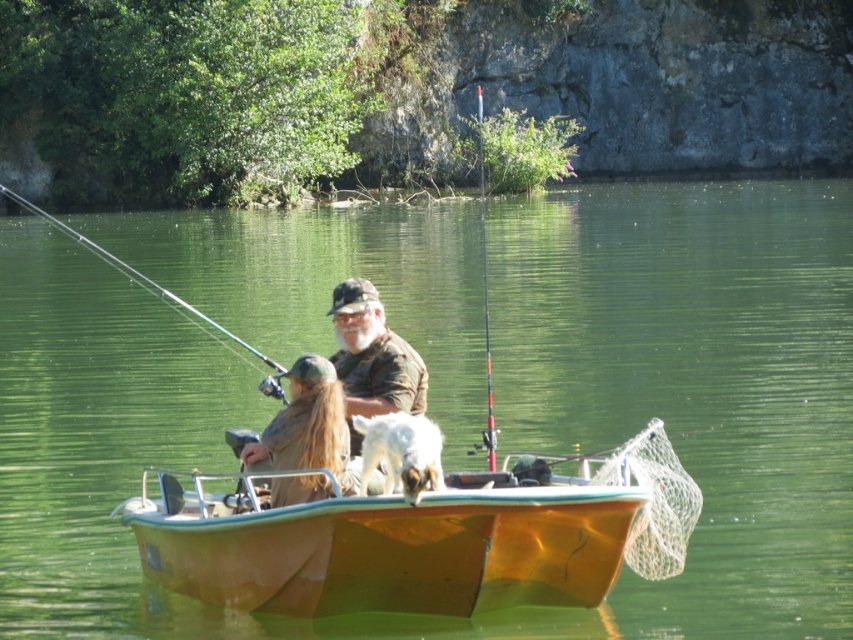
Question: Does white mesh fishing net at right have a smaller size compared to orange fiberglass fishing pole at center?

Choices:
 (A) yes
 (B) no

Answer: (A)

Question: Estimate the real-world distances between objects in this image. Which object is farther from the camouflage fabric shirt at center?

Choices:
 (A) brown suede jacket at center
 (B) matte black fishing pole at upper left

Answer: (B)

Question: Can you confirm if green water at center is bigger than matte black fishing pole at upper left?

Choices:
 (A) yes
 (B) no

Answer: (A)

Question: Considering the real-world distances, which object is farthest from the brown suede jacket at center?

Choices:
 (A) white mesh fishing net at right
 (B) matte black fishing pole at upper left
 (C) orange fiberglass fishing pole at center

Answer: (B)

Question: Does green water at center have a larger size compared to brown suede jacket at center?

Choices:
 (A) no
 (B) yes

Answer: (B)

Question: Among these points, which one is nearest to the camera?

Choices:
 (A) (351, 284)
 (B) (639, 385)
 (C) (479, 112)

Answer: (A)